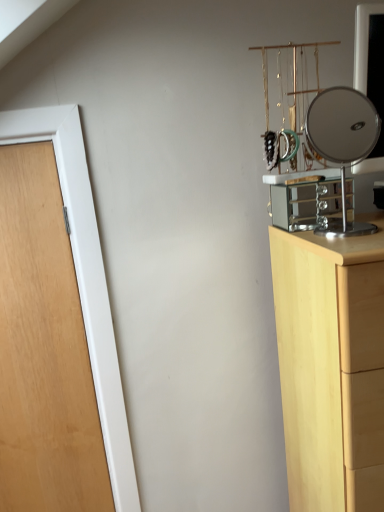
Question: Considering the positions of light wood chest of drawers at right and polished silver mirror at right in the image, is light wood chest of drawers at right taller or shorter than polished silver mirror at right?

Choices:
 (A) tall
 (B) short

Answer: (A)

Question: From a real-world perspective, is light wood chest of drawers at right positioned above or below polished silver mirror at right?

Choices:
 (A) above
 (B) below

Answer: (B)

Question: Which of these objects is positioned farthest from the light wood chest of drawers at right?

Choices:
 (A) polished silver mirror at right
 (B) wooden door at left

Answer: (A)

Question: Which object is the closest to the wooden door at left?

Choices:
 (A) polished silver mirror at right
 (B) light wood chest of drawers at right

Answer: (B)